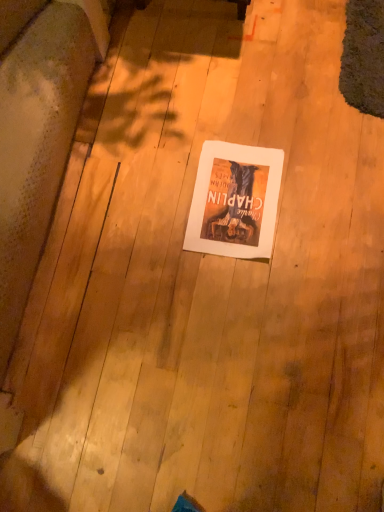
Where is `vacant space behind white paper poster at center`? vacant space behind white paper poster at center is located at coordinates [216, 125].